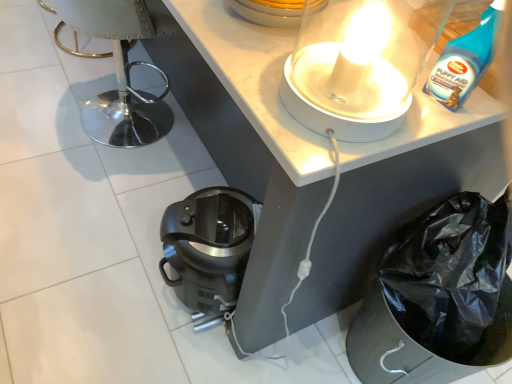
Identify the location of free space that is in between black plastic coffee maker at lower center and metallic silver swivel chair at left. (146, 186).